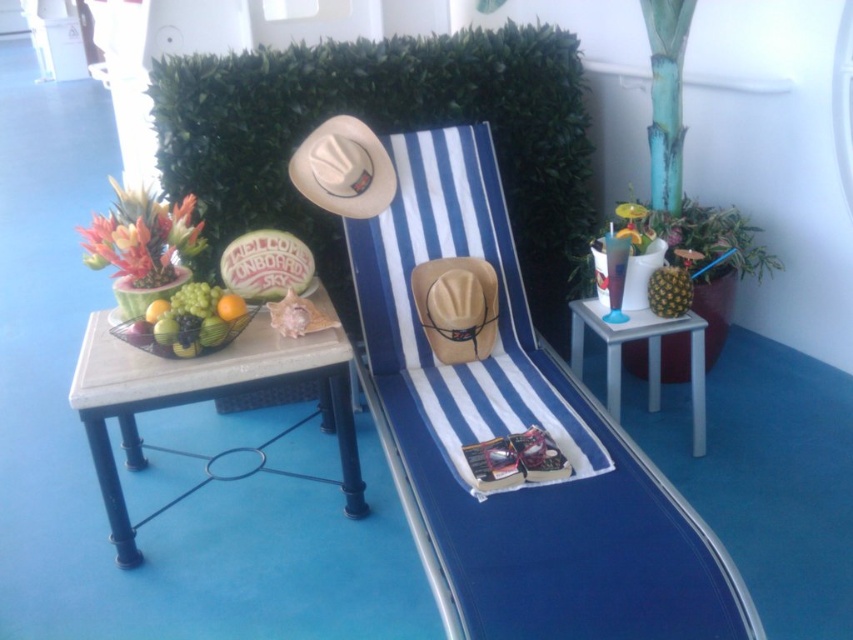
Which is behind, point (641, 529) or point (486, 266)?

The point (486, 266) is more distant.

Measure the distance from blue striped beach chair at center to tan leather cowboy hat at center.

They are 20.70 centimeters apart.

Which is in front, point (634, 452) or point (421, 296)?

Point (634, 452) is more forward.

The width and height of the screenshot is (853, 640). Identify the location of blue striped beach chair at center. (517, 429).

What do you see at coordinates (517, 429) in the screenshot? This screenshot has height=640, width=853. I see `blue striped beach chair at center` at bounding box center [517, 429].

Where is `blue striped beach chair at center`? This screenshot has width=853, height=640. blue striped beach chair at center is located at coordinates (517, 429).

Which is behind, point (167, 152) or point (289, 173)?

The point (289, 173) is more distant.

Is green leafy hedge at upper center smaller than brown straw cowboy hat at center?

Incorrect, green leafy hedge at upper center is not smaller in size than brown straw cowboy hat at center.

Where is `green leafy hedge at upper center`? The height and width of the screenshot is (640, 853). green leafy hedge at upper center is located at coordinates (384, 132).